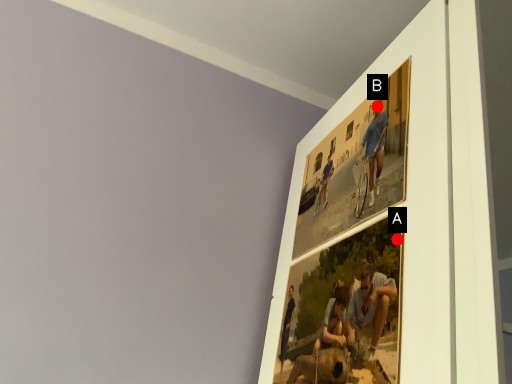
Question: Two points are circled on the image, labeled by A and B beside each circle. Which point is closer to the camera?

Choices:
 (A) A is closer
 (B) B is closer

Answer: (A)